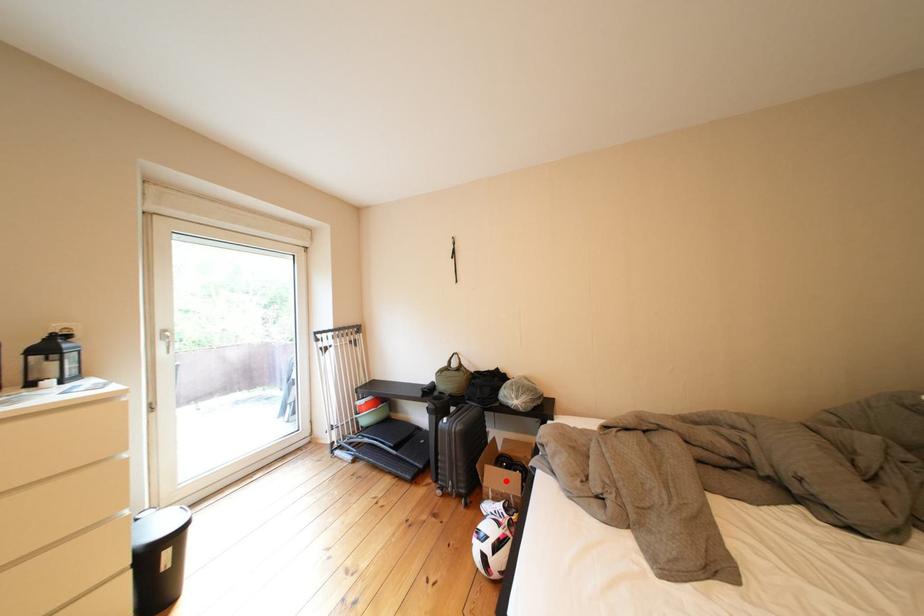
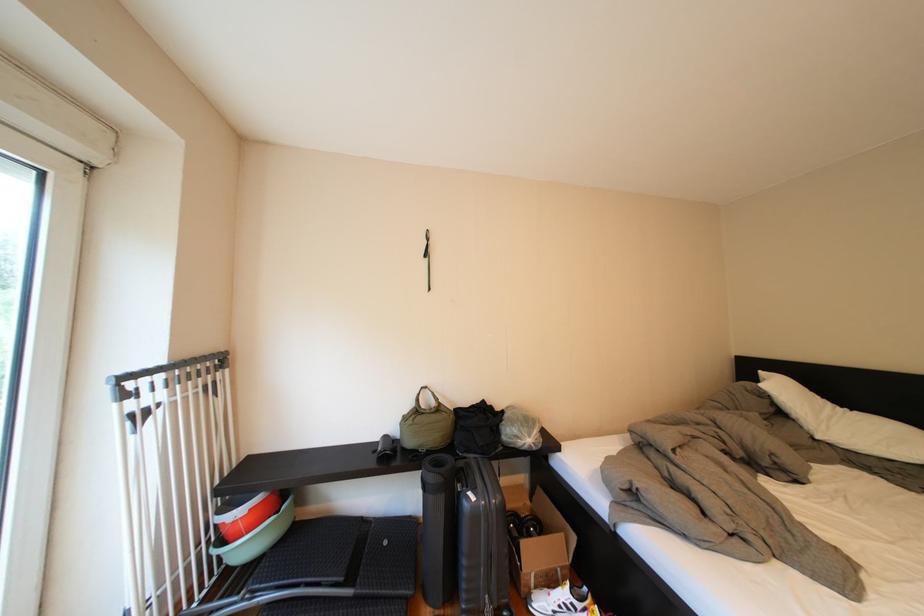
Question: I am providing you with two images of the same scene from different viewpoints. Given a red point in image1, look at the same physical point in image2. Is it:

Choices:
 (A) Closer to the viewpoint
 (B) Farther from the viewpoint

Answer: (B)